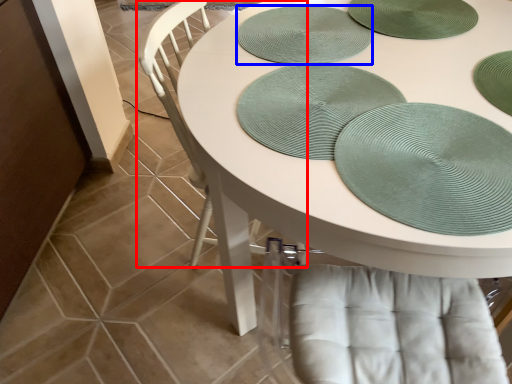
Question: Which object appears farthest to the camera in this image, chair (highlighted by a red box) or platter (highlighted by a blue box)?

Choices:
 (A) chair
 (B) platter

Answer: (B)